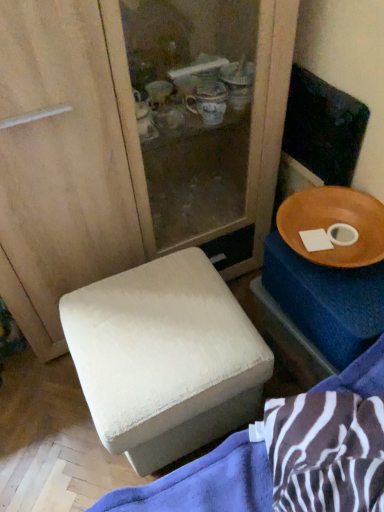
Question: Is wooden bowl at right smaller than white fabric ottoman at lower left?

Choices:
 (A) yes
 (B) no

Answer: (A)

Question: Can you confirm if wooden bowl at right is taller than white fabric ottoman at lower left?

Choices:
 (A) yes
 (B) no

Answer: (B)

Question: Can you confirm if wooden bowl at right is shorter than white fabric ottoman at lower left?

Choices:
 (A) no
 (B) yes

Answer: (B)

Question: Is wooden bowl at right further to camera compared to white fabric ottoman at lower left?

Choices:
 (A) yes
 (B) no

Answer: (A)

Question: Does wooden bowl at right have a lesser width compared to white fabric ottoman at lower left?

Choices:
 (A) yes
 (B) no

Answer: (A)

Question: Is wooden bowl at right next to white fabric ottoman at lower left?

Choices:
 (A) no
 (B) yes

Answer: (A)

Question: From the image's perspective, would you say wooden tray at right is positioned over white fabric ottoman at lower left?

Choices:
 (A) no
 (B) yes

Answer: (B)

Question: Is white fabric ottoman at lower left completely or partially inside wooden tray at right?

Choices:
 (A) yes
 (B) no

Answer: (B)

Question: Does wooden tray at right have a lesser width compared to white fabric ottoman at lower left?

Choices:
 (A) no
 (B) yes

Answer: (B)

Question: From the image's perspective, is wooden tray at right beneath white fabric ottoman at lower left?

Choices:
 (A) no
 (B) yes

Answer: (A)

Question: Considering the relative sizes of wooden tray at right and white fabric ottoman at lower left in the image provided, is wooden tray at right smaller than white fabric ottoman at lower left?

Choices:
 (A) yes
 (B) no

Answer: (A)

Question: From a real-world perspective, does wooden tray at right sit lower than white fabric ottoman at lower left?

Choices:
 (A) yes
 (B) no

Answer: (A)

Question: From the image's perspective, would you say white fabric ottoman at lower left is shown under wooden bowl at right?

Choices:
 (A) yes
 (B) no

Answer: (A)